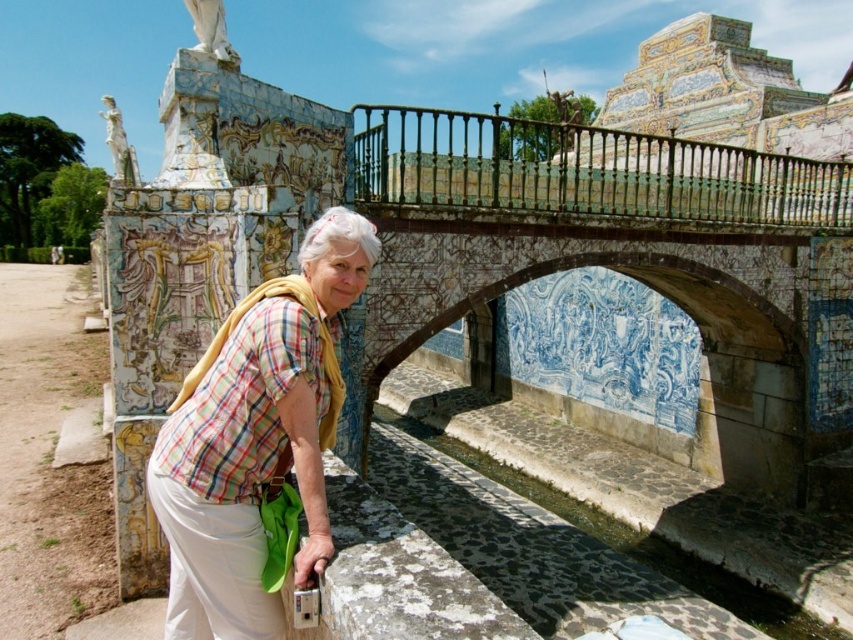
You are a photographer trying to capture both the khaki fabric at lower left and the white marble statue at upper left in a single frame. Based on their sizes in the scene, which object will appear smaller in the photo?

The khaki fabric at lower left will appear smaller in the photo because it occupies less space than the white marble statue at upper left.

From the picture: You are standing in front of the stone wall with azulejo tiles and want to take a photo of both the point at coordinates [247,500] and the point at [256,589]. Since you can only focus on one point at a time, which point should you choose to ensure the other is still in the background?

You should focus on point [247,500] because it is closer to you, allowing the farther point [256,589] to remain in the background.